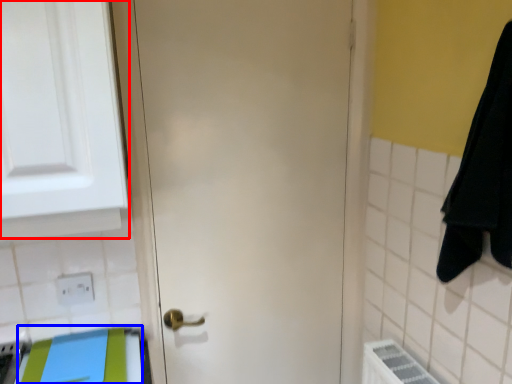
Question: Which object is closer to the camera taking this photo, medicine cabinet (highlighted by a red box) or beach towel (highlighted by a blue box)?

Choices:
 (A) medicine cabinet
 (B) beach towel

Answer: (A)